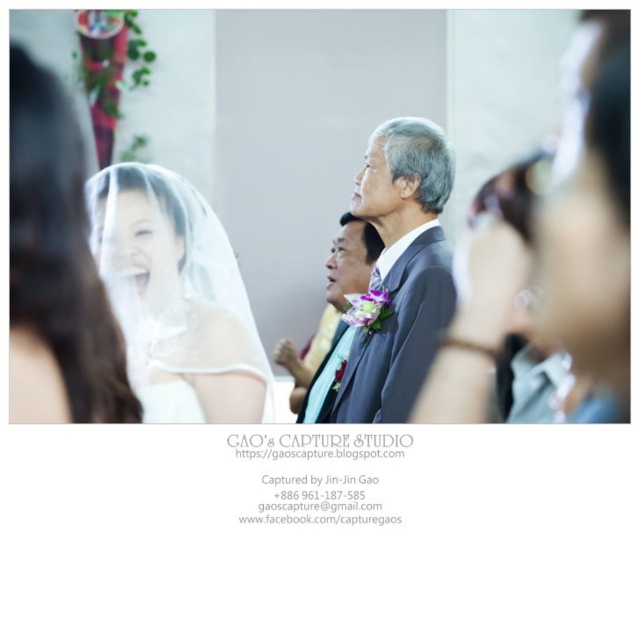
Question: Which of the following is the farthest from the observer?

Choices:
 (A) (56, 260)
 (B) (294, 374)
 (C) (168, 332)
 (D) (390, 371)

Answer: (B)

Question: Is dark gray suit at center smaller than satin black suit at center?

Choices:
 (A) no
 (B) yes

Answer: (A)

Question: Which point appears farthest from the camera in this image?

Choices:
 (A) (307, 369)
 (B) (497, 164)
 (C) (86, 408)
 (D) (216, 384)

Answer: (B)

Question: Among these points, which one is nearest to the camera?

Choices:
 (A) (116, 289)
 (B) (24, 104)
 (C) (412, 378)
 (D) (346, 259)

Answer: (B)

Question: In this image, where is dark gray suit at center located relative to satin black suit at center?

Choices:
 (A) left
 (B) right

Answer: (B)

Question: Observing the image, what is the correct spatial positioning of white satin veil at upper left in reference to dark gray suit at center?

Choices:
 (A) left
 (B) right

Answer: (A)